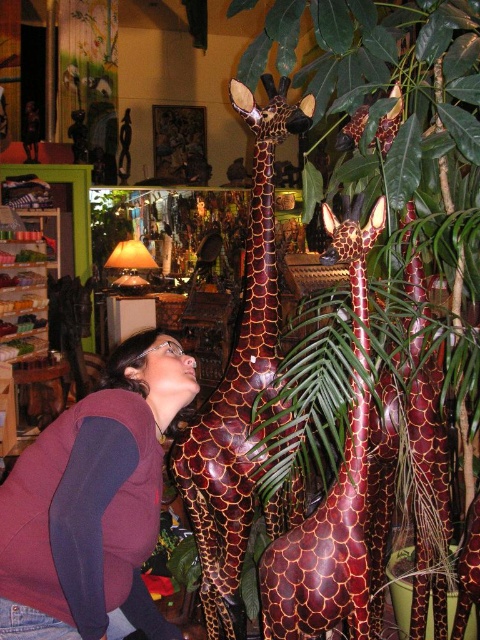
Is shiny brown giraffe at center taller than brown scaly giraffe at center?

Yes, shiny brown giraffe at center is taller than brown scaly giraffe at center.

From the picture: Does shiny brown giraffe at center have a greater width compared to brown scaly giraffe at center?

Correct, the width of shiny brown giraffe at center exceeds that of brown scaly giraffe at center.

Measure the distance between shiny brown giraffe at center and camera.

shiny brown giraffe at center and camera are 4.15 feet apart from each other.

Find the location of a particular element. This screenshot has width=480, height=640. shiny brown giraffe at center is located at coordinates (239, 378).

In the scene shown: Is green leafy plant at center wider than brown scaly giraffe at center?

Yes.

Measure the distance between green leafy plant at center and brown scaly giraffe at center.

13.96 inches

Measure the distance between green leafy plant at center and camera.

green leafy plant at center is 3.39 feet away from camera.

The height and width of the screenshot is (640, 480). What are the coordinates of `green leafy plant at center` in the screenshot? It's located at (384, 308).

Which is behind, point (460, 115) or point (147, 492)?

Positioned behind is point (460, 115).

Is point (429, 394) positioned after point (27, 602)?

Yes, it is behind point (27, 602).

Which is in front, point (363, 80) or point (120, 506)?

Point (120, 506) is in front.

You are a GUI agent. You are given a task and a screenshot of the screen. Output one action in this format:
    pyautogui.click(x=<x>, y=<y>)
    Task: Click on the green leafy plant at center
    
    Given the screenshot: What is the action you would take?
    pyautogui.click(x=384, y=308)